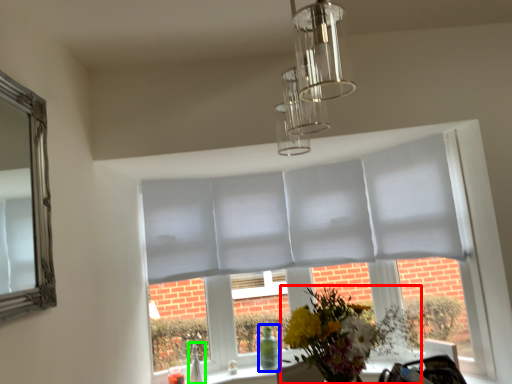
Question: Considering the real-world distances, which object is farthest from flower (highlighted by a red box)? glass vase (highlighted by a blue box) or glass vase (highlighted by a green box)?

Choices:
 (A) glass vase
 (B) glass vase

Answer: (B)